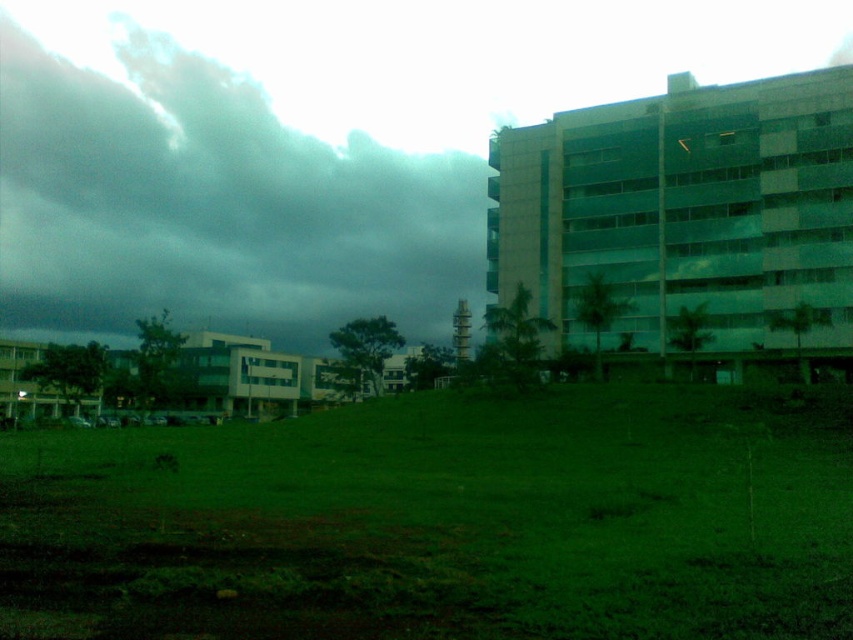
You are standing in the urban landscape and want to take a photo of the green grassy field at lower center and the dark gray cloud at upper left. Which object will appear smaller in the photo?

The green grassy field at lower center will appear smaller in the photo because it has a lesser height compared to the dark gray cloud at upper left.